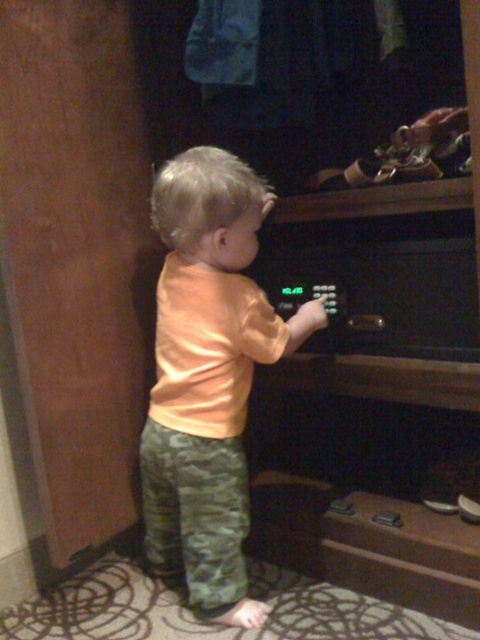
Is orange matte shirt at center smaller than green digital display at center?

Incorrect, orange matte shirt at center is not smaller in size than green digital display at center.

Is orange matte shirt at center thinner than green digital display at center?

No.

Which is behind, point (199, 472) or point (340, 285)?

Point (340, 285)

Image resolution: width=480 pixels, height=640 pixels. I want to click on orange matte shirt at center, so click(x=207, y=376).